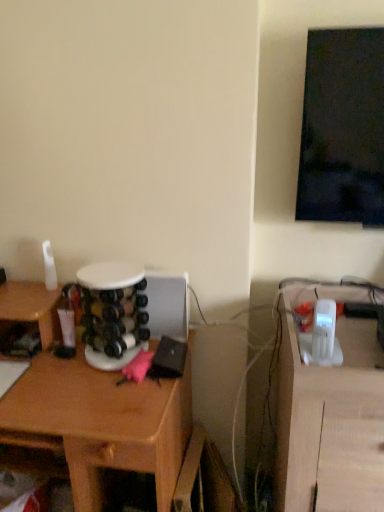
Question: Based on their sizes in the image, would you say wooden desk at left is bigger or smaller than white plastic phone at right?

Choices:
 (A) big
 (B) small

Answer: (A)

Question: In terms of height, does wooden desk at left look taller or shorter compared to white plastic phone at right?

Choices:
 (A) short
 (B) tall

Answer: (A)

Question: Does point (134, 382) appear closer or farther from the camera than point (296, 385)?

Choices:
 (A) closer
 (B) farther

Answer: (B)

Question: Considering the positions of point (319, 388) and point (77, 393), is point (319, 388) closer or farther from the camera than point (77, 393)?

Choices:
 (A) closer
 (B) farther

Answer: (A)

Question: Is white plastic phone at right wider or thinner than wooden desk at left?

Choices:
 (A) thin
 (B) wide

Answer: (B)

Question: Do you think white plastic phone at right is within wooden desk at left, or outside of it?

Choices:
 (A) outside
 (B) inside

Answer: (A)

Question: Based on their sizes in the image, would you say white plastic phone at right is bigger or smaller than wooden desk at left?

Choices:
 (A) big
 (B) small

Answer: (B)